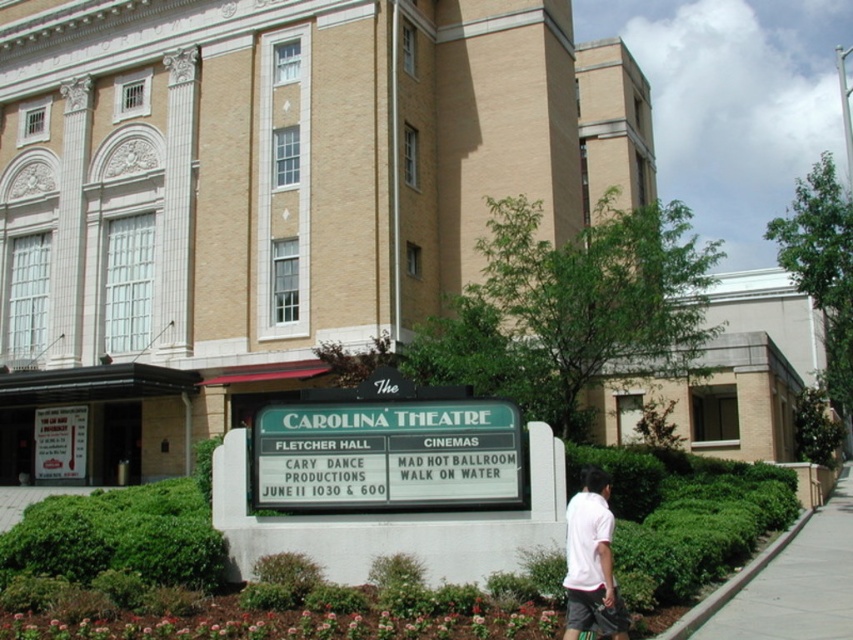
Does white cotton shirt at lower right have a larger size compared to white paper menu at lower left?

Yes, white cotton shirt at lower right is bigger than white paper menu at lower left.

Which is more to the left, white cotton shirt at lower right or white paper menu at lower left?

Positioned to the left is white paper menu at lower left.

Who is more distant from viewer, (612, 520) or (67, 454)?

Positioned behind is point (67, 454).

Identify the location of white cotton shirt at lower right. (590, 561).

Between point (502, 467) and point (799, 572), which one is positioned behind?

The point (799, 572) is behind.

Is point (311, 410) positioned in front of point (820, 616)?

No, (311, 410) is behind (820, 616).

Does point (460, 486) come behind point (811, 522)?

No, (460, 486) is closer to viewer.

You are a GUI agent. You are given a task and a screenshot of the screen. Output one action in this format:
    pyautogui.click(x=<x>, y=<y>)
    Task: Click on the green plastic sign at center
    This screenshot has height=640, width=853.
    Given the screenshot: What is the action you would take?
    pyautogui.click(x=386, y=454)

Who is positioned more to the right, white paper menu at lower left or green grass at lower left?

From the viewer's perspective, green grass at lower left appears more on the right side.

Is point (73, 468) positioned after point (68, 492)?

Yes, point (73, 468) is behind point (68, 492).

Is point (44, 456) positioned before point (9, 518)?

No, (44, 456) is further to viewer.

I want to click on white paper menu at lower left, so click(61, 442).